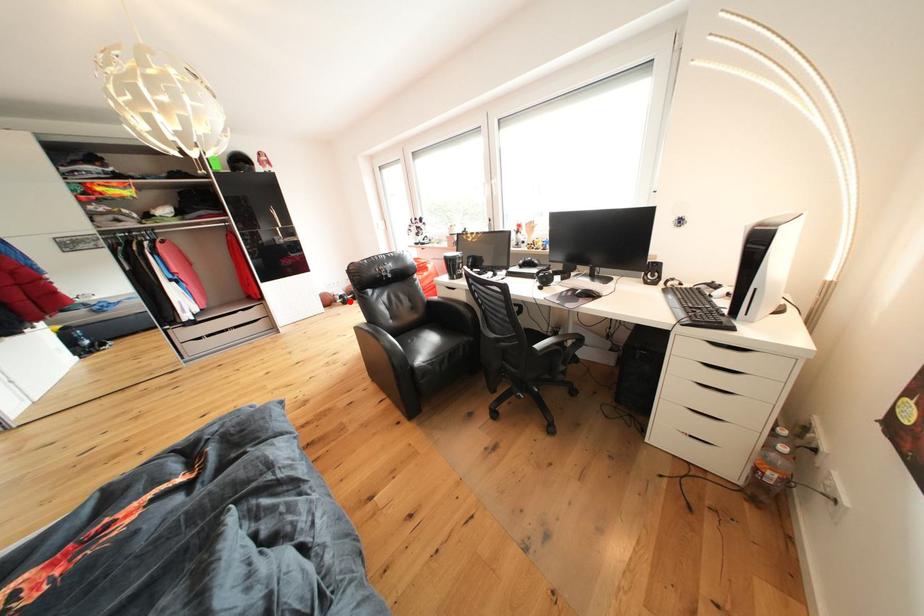
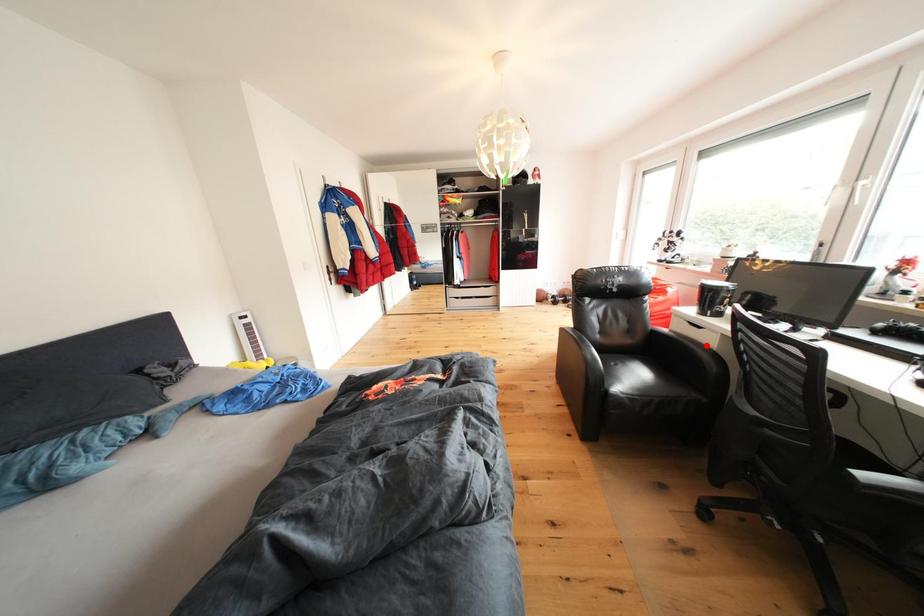
I am providing you with two images of the same scene from different viewpoints. A red point is marked on the first image and another point is marked on the second image. Do the highlighted points in image1 and image2 indicate the same real-world spot?

No